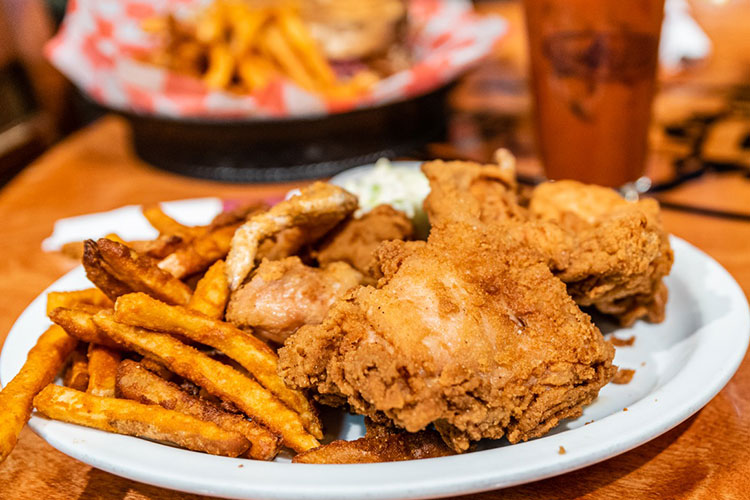
In order to click on plate, white in this screenshot , I will do `click(692, 351)`.